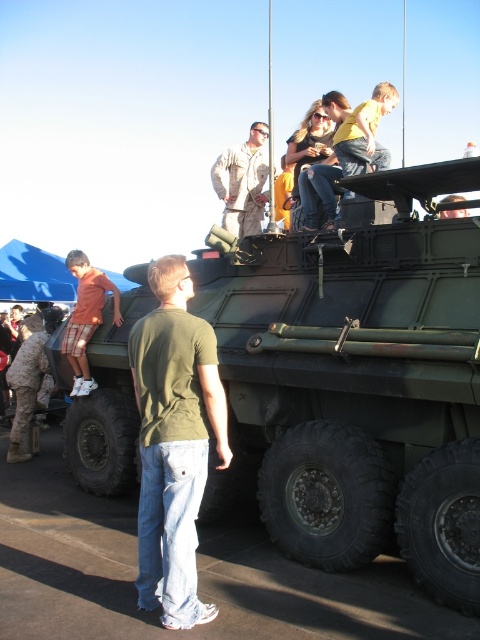
Question: Among these objects, which one is farthest from the camera?

Choices:
 (A) green matte tank at upper center
 (B) matte red shorts at left
 (C) green cotton shirt at center
 (D) camouflage fabric uniform at center

Answer: (D)

Question: Is green cotton shirt at center below matte red shorts at left?

Choices:
 (A) no
 (B) yes

Answer: (B)

Question: Which of the following is the farthest from the observer?

Choices:
 (A) green cotton shirt at center
 (B) green matte tank at upper center
 (C) matte red shorts at left
 (D) camouflage fabric uniform at center

Answer: (D)

Question: From the image, what is the correct spatial relationship of green matte tank at upper center in relation to camouflage fabric uniform at center?

Choices:
 (A) above
 (B) below

Answer: (B)

Question: Which of the following is the farthest from the observer?

Choices:
 (A) (82, 275)
 (B) (463, 474)
 (C) (238, 236)

Answer: (C)

Question: In this image, where is green matte tank at upper center located relative to matte red shorts at left?

Choices:
 (A) above
 (B) below

Answer: (B)